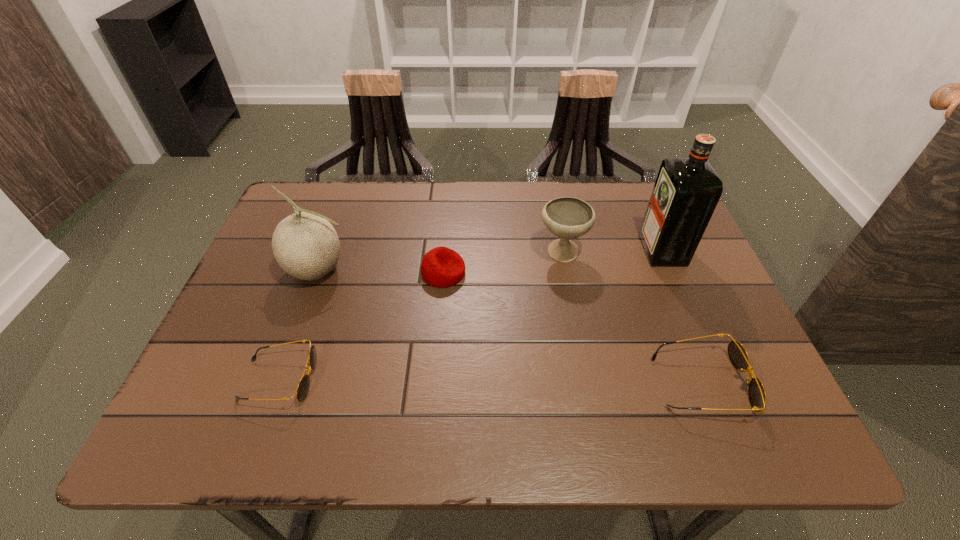
Identify the location of free spot between the third object from left to right and the fourth shortest object. (503, 263).

Where is `vacant space in between the beanbag and the third tallest object`? vacant space in between the beanbag and the third tallest object is located at coordinates (503, 263).

Identify which object is the second closest to the second tallest object. Please provide its 2D coordinates. Your answer should be formatted as a tuple, i.e. [(x, y)], where the tuple contains the x and y coordinates of a point satisfying the conditions above.

[(441, 267)]

Locate an element on the screen. The height and width of the screenshot is (540, 960). object that stands as the fifth closest to the right sunglasses is located at coordinates (305, 245).

Find the location of a particular element. The width and height of the screenshot is (960, 540). vacant area that satisfies the following two spatial constraints: 1. on the front label of the tallest object; 2. on the front side of the fourth object from left to right is located at coordinates click(663, 253).